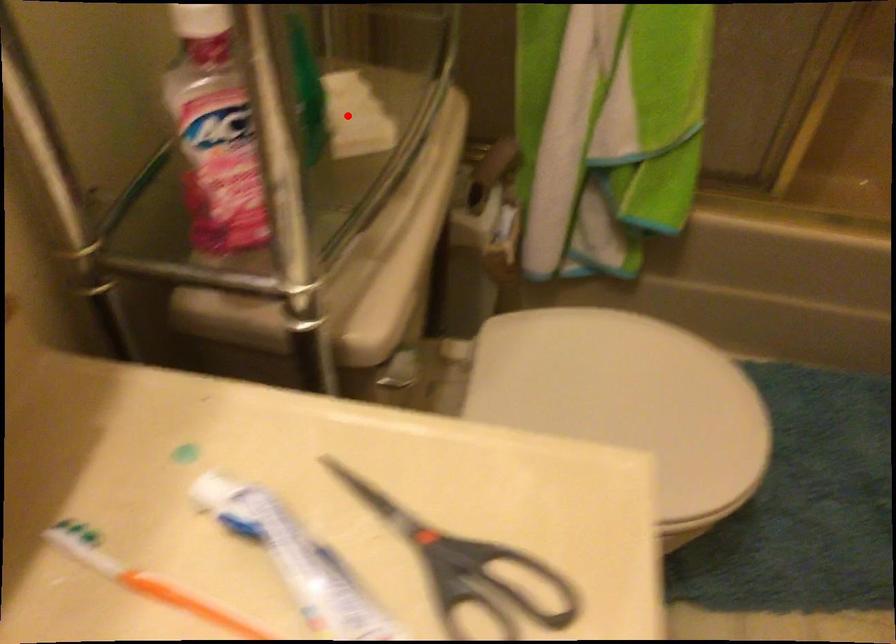
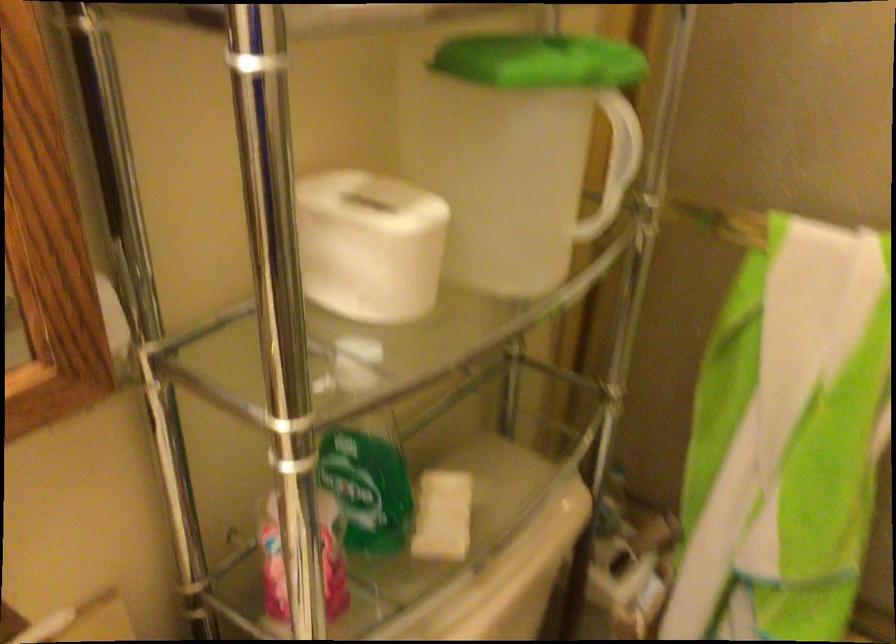
Locate, in the second image, the point that corresponds to the highlighted location in the first image.

(442, 516)